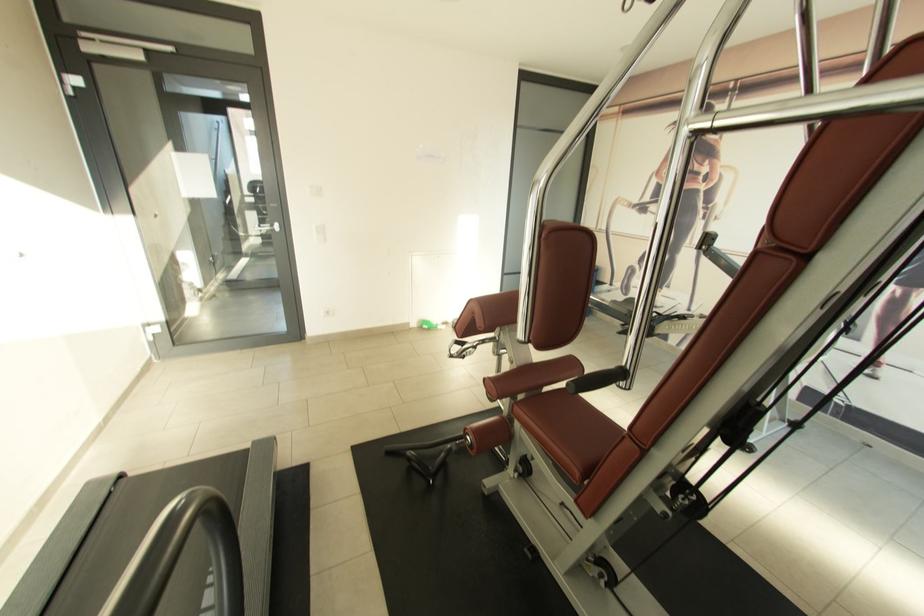
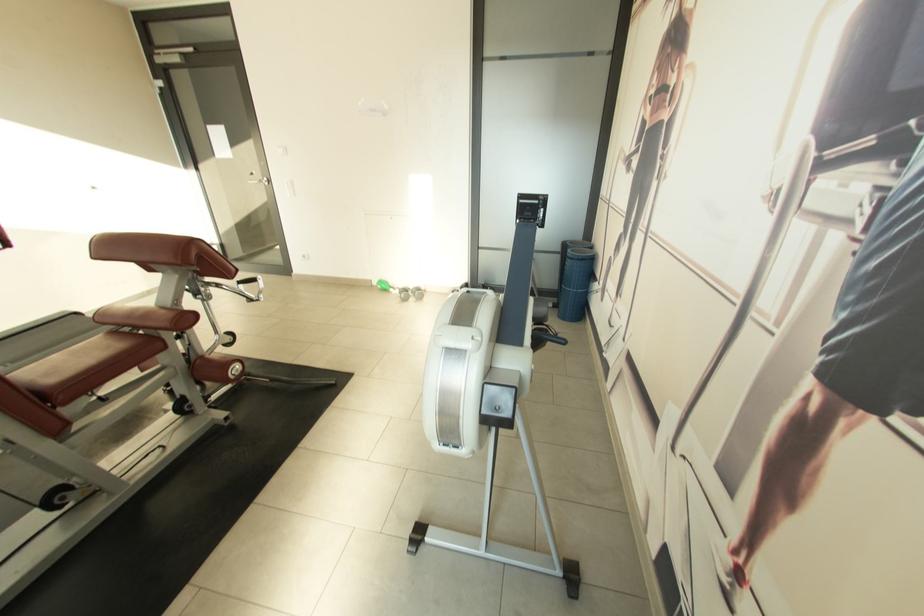
The point at (162, 217) is marked in the first image. Where is the corresponding point in the second image?

(258, 175)